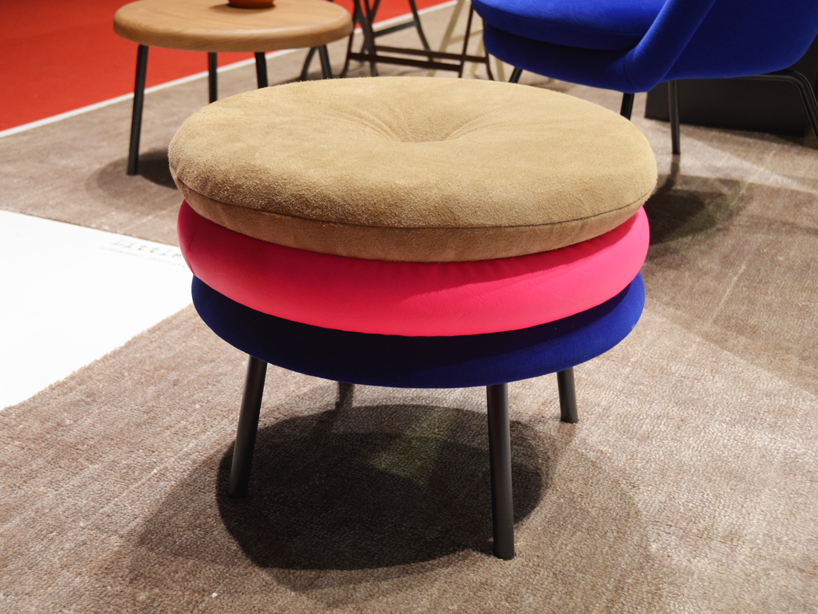
The width and height of the screenshot is (818, 614). What are the coordinates of `seat` in the screenshot? It's located at (447, 308).